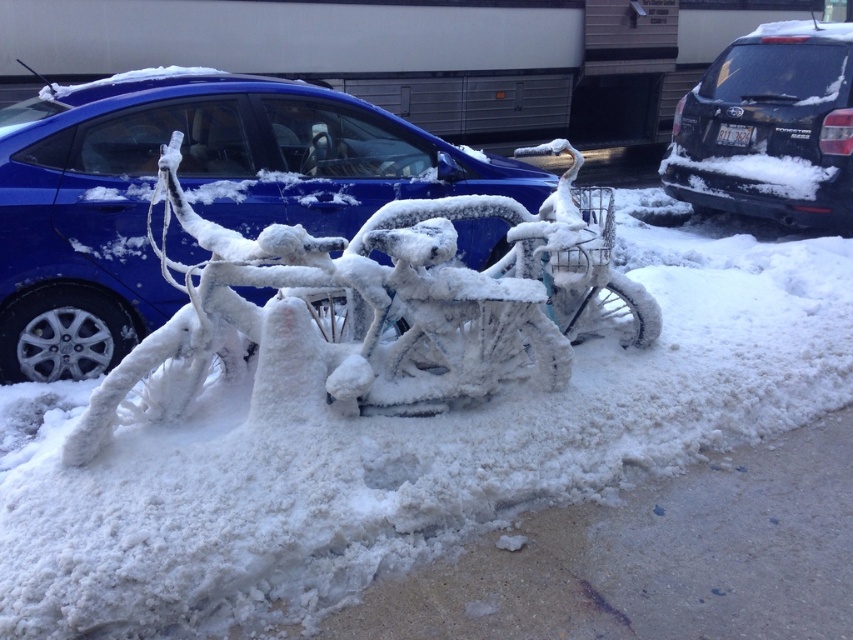
Looking at this image, you are standing at the origin point of the image coordinate system. You want to locate the matte blue car at center. In which direction should you move from the origin to reach it?

The matte blue car at center is located at point (189, 192), so you should move 30.000 centimeters to the right and 22.200 centimeters downward from the origin to reach it.

You are standing at the center of the snowy scene. Where is the white frosty bicycle at center located in relation to your position?

The white frosty bicycle at center is located at point (407, 452) in the scene.

You are a delivery person needing to park your vehicle. You see the white frosty bicycle at center and the black matte suv at upper right. Which vehicle is shorter in height so you can park under a low clearance bridge?

The white frosty bicycle at center is not as tall as the black matte suv at upper right, so the white frosty bicycle at center is shorter in height and can be parked under the low clearance bridge.